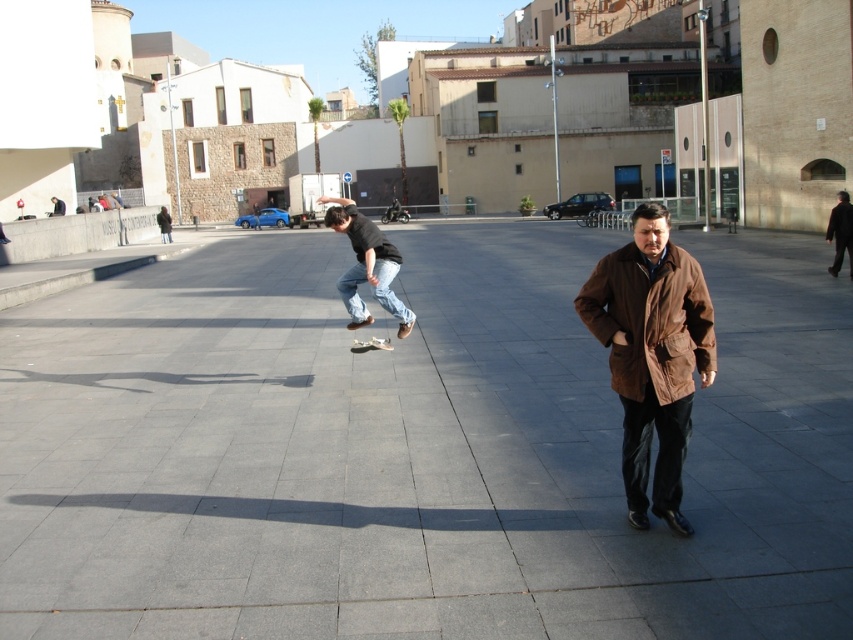
Question: Which object is the farthest from the dark brown leather jacket at right?

Choices:
 (A) brown leather coat at right
 (B) denim jeans at center
 (C) wooden smooth skateboard at center
 (D) gray concrete pavement at center

Answer: (A)

Question: Does gray concrete pavement at center have a larger size compared to wooden smooth skateboard at center?

Choices:
 (A) no
 (B) yes

Answer: (B)

Question: Which point is farther from the camera taking this photo?

Choices:
 (A) (593, 310)
 (B) (358, 352)
 (C) (838, 211)

Answer: (C)

Question: Which of the following is the closest to the observer?

Choices:
 (A) gray concrete pavement at center
 (B) wooden smooth skateboard at center
 (C) denim jeans at center
 (D) brown leather coat at right

Answer: (A)

Question: Can you confirm if brown leather coat at right is thinner than dark brown leather jacket at right?

Choices:
 (A) yes
 (B) no

Answer: (A)

Question: Can you confirm if brown leather coat at right is thinner than wooden smooth skateboard at center?

Choices:
 (A) no
 (B) yes

Answer: (B)